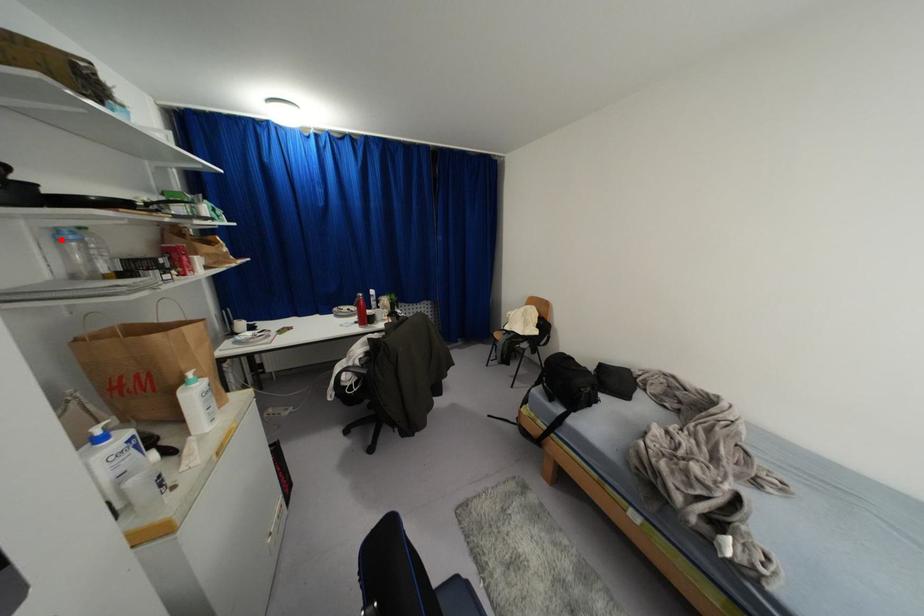
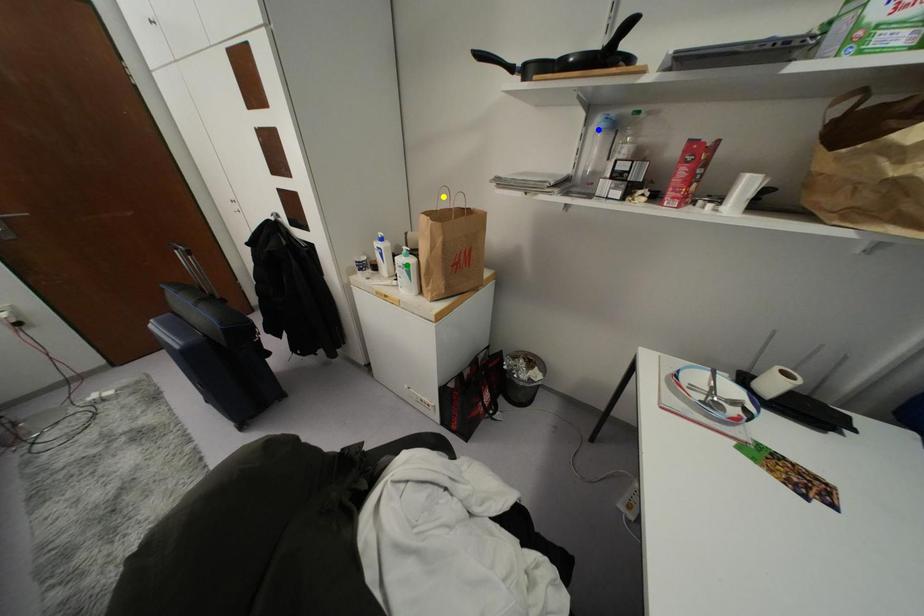
Question: I am providing you with two images of the same scene from different viewpoints. A red point is marked on the first image. You are given multiple points on the second image. Which spot in image 2 lines up with the point in image 1?

Choices:
 (A) yellow point
 (B) green point
 (C) blue point

Answer: (C)